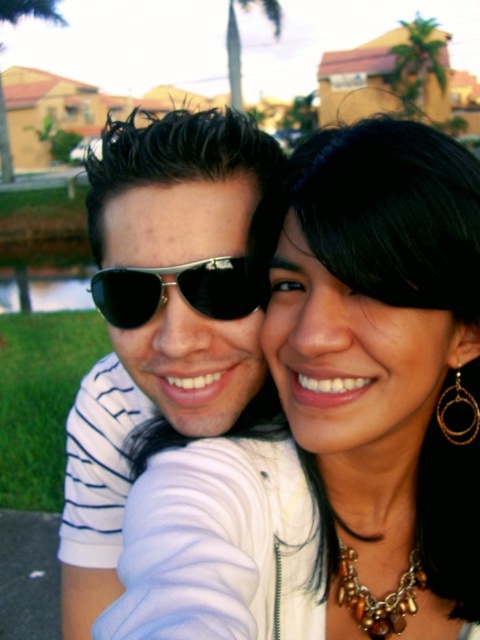
Can you confirm if matte black sunglasses at center is positioned to the left of metallic aviator sunglasses at center?

Yes, matte black sunglasses at center is to the left of metallic aviator sunglasses at center.

Describe the element at coordinates (159, 317) in the screenshot. This screenshot has width=480, height=640. I see `matte black sunglasses at center` at that location.

This screenshot has width=480, height=640. I want to click on matte black sunglasses at center, so coord(159,317).

Is white fabric at center taller than metallic aviator sunglasses at center?

Yes, white fabric at center is taller than metallic aviator sunglasses at center.

Who is more distant from viewer, (436, 410) or (188, 276)?

Positioned behind is point (436, 410).

Is point (357, 323) less distant than point (243, 310)?

Yes, it is.

At what (x,y) coordinates should I click in order to perform the action: click on white fabric at center. Please return your answer as a coordinate pair (x, y). Looking at the image, I should click on (336, 419).

Consider the image. Can you confirm if white fabric at center is wider than matte black sunglasses at center?

Incorrect, white fabric at center's width does not surpass matte black sunglasses at center's.

Is the position of white fabric at center less distant than that of matte black sunglasses at center?

Yes, it is.

Which is behind, point (160, 481) or point (220, 241)?

The point (220, 241) is behind.

Where is `white fabric at center`? The width and height of the screenshot is (480, 640). white fabric at center is located at coordinates (336, 419).